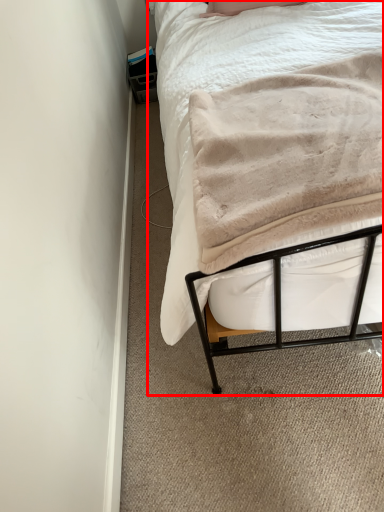
Question: From the image's perspective, where is bed (annotated by the red box) located in relation to blanket in the image?

Choices:
 (A) above
 (B) below

Answer: (A)